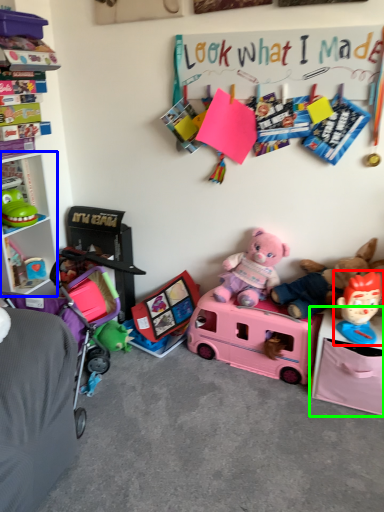
Question: Estimate the real-world distances between objects in this image. Which object is farther from toy (highlighted by a red box), cabinet (highlighted by a blue box) or changing table (highlighted by a green box)?

Choices:
 (A) cabinet
 (B) changing table

Answer: (A)